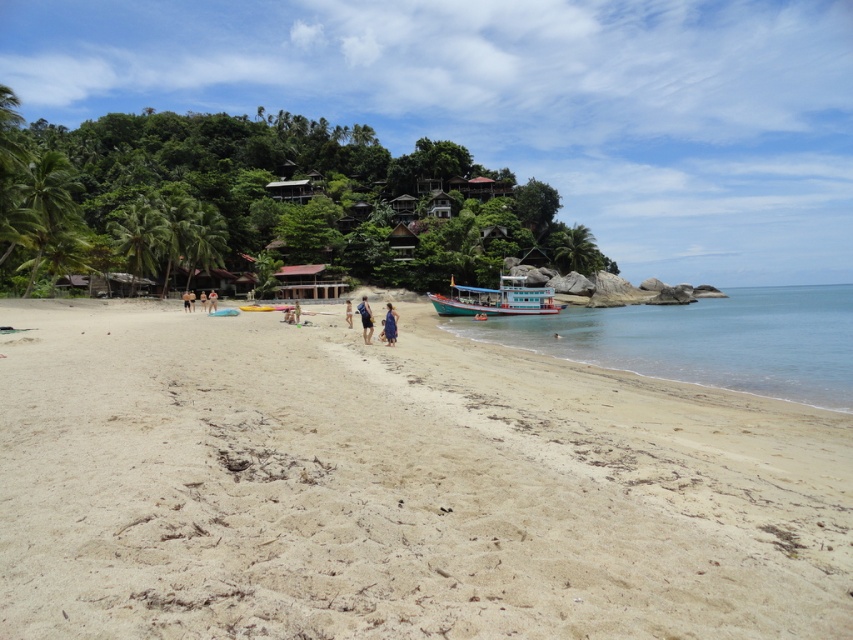
Question: Can you confirm if matte blue swimsuit at center is wider than tan skin person at center?

Choices:
 (A) no
 (B) yes

Answer: (B)

Question: Which point appears closest to the camera in this image?

Choices:
 (A) (850, 564)
 (B) (297, 305)
 (C) (350, 316)

Answer: (A)

Question: In this image, where is beige sandy beach at center located relative to teal wooden boat at center?

Choices:
 (A) right
 (B) left

Answer: (B)

Question: Which point is farther from the camera taking this photo?

Choices:
 (A) (456, 292)
 (B) (352, 312)
 (C) (367, 321)

Answer: (A)

Question: Which object appears farthest from the camera in this image?

Choices:
 (A) tan skin person at center
 (B) matte blue swimsuit at center

Answer: (A)

Question: Is beige sandy beach at center in front of matte blue swimsuit at center?

Choices:
 (A) yes
 (B) no

Answer: (A)